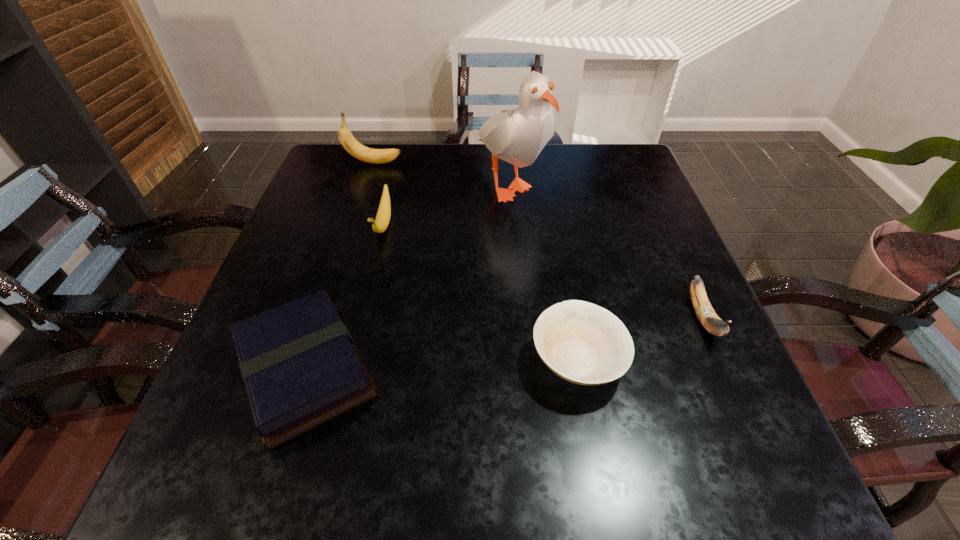
What are the coordinates of `object that is at the far left corner` in the screenshot? It's located at (376, 156).

Identify the location of object that is at the near left corner. (300, 367).

In the image, there is a desktop. In order to click on free region at the far edge in this screenshot , I will do click(x=418, y=162).

Image resolution: width=960 pixels, height=540 pixels. In order to click on vacant space at the near edge of the desktop in this screenshot , I will do `click(596, 485)`.

In the image, there is a desktop. In order to click on free space at the left edge in this screenshot , I will do `click(336, 244)`.

Where is `free space at the right edge`? This screenshot has width=960, height=540. free space at the right edge is located at coordinates (625, 197).

The height and width of the screenshot is (540, 960). What are the coordinates of `free space at the far left corner of the desktop` in the screenshot? It's located at (365, 184).

You are a GUI agent. You are given a task and a screenshot of the screen. Output one action in this format:
    pyautogui.click(x=<x>, y=<y>)
    Task: Click on the vacant point at the far right corner
    
    Given the screenshot: What is the action you would take?
    pyautogui.click(x=617, y=176)

The image size is (960, 540). I want to click on vacant space at the near right corner of the desktop, so click(676, 480).

In order to click on blank region between the bowl and the second farthest banana in this screenshot , I will do `click(481, 293)`.